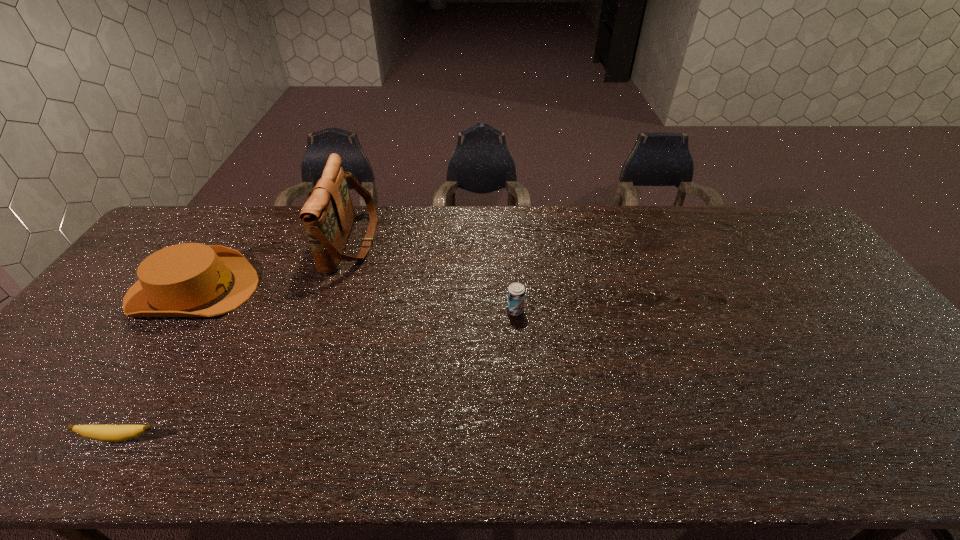
Locate an element on the screen. The width and height of the screenshot is (960, 540). vacant area that lies between the third object from left to right and the nearest object is located at coordinates (235, 340).

Where is `free area in between the rightmost object and the cowboy hat`? This screenshot has width=960, height=540. free area in between the rightmost object and the cowboy hat is located at coordinates (354, 300).

The image size is (960, 540). What are the coordinates of `free space between the shortest object and the cowboy hat` in the screenshot? It's located at pos(156,363).

In order to click on empty location between the nearest object and the rightmost object in this screenshot , I will do `click(318, 374)`.

Locate an element on the screen. The height and width of the screenshot is (540, 960). unoccupied position between the shortest object and the cowboy hat is located at coordinates (156, 363).

The width and height of the screenshot is (960, 540). I want to click on vacant region between the shortest object and the cowboy hat, so click(x=156, y=363).

Locate an element on the screen. This screenshot has height=540, width=960. blank region between the beer can and the banana is located at coordinates (318, 374).

Where is `object that is the second closest to the cowboy hat`? Image resolution: width=960 pixels, height=540 pixels. object that is the second closest to the cowboy hat is located at coordinates (108, 433).

Identify the location of object that is the second closest to the nearest object. [328, 215].

Where is `free space that satisfies the following two spatial constraints: 1. on the front-facing side of the cowboy hat; 2. on the right side of the banana`? Image resolution: width=960 pixels, height=540 pixels. free space that satisfies the following two spatial constraints: 1. on the front-facing side of the cowboy hat; 2. on the right side of the banana is located at coordinates (93, 437).